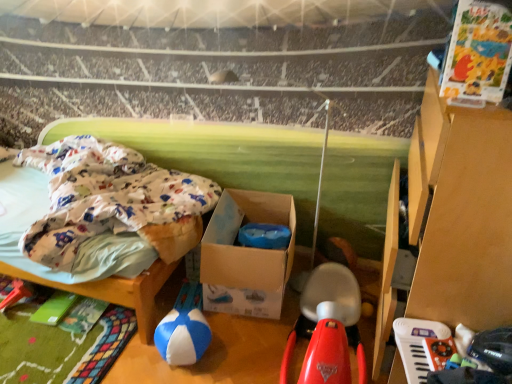
Question: Looking at their shapes, would you say cardboard box at center is wider or thinner than blue/white fabric ball at center, the 1th toy viewed from the left?

Choices:
 (A) wide
 (B) thin

Answer: (A)

Question: Considering the relative positions of cardboard box at center and blue/white fabric ball at center, the 1th toy viewed from the left, in the image provided, is cardboard box at center to the left or to the right of blue/white fabric ball at center, the 1th toy viewed from the left,?

Choices:
 (A) right
 (B) left

Answer: (A)

Question: Estimate the real-world distances between objects in this image. Which object is farther from the cardboard box at center?

Choices:
 (A) white fabric bed at upper left, acting as the 1th furniture starting from the left
 (B) blue/white fabric ball at center, the 1th toy viewed from the left
 (C) brown cardboard drawer at right, which appears as the second furniture when viewed from the left
 (D) rubberized red scooter at center, marked as the 2th toy in a right-to-left arrangement
 (E) white plastic keyboard at lower right, acting as the 3th toy starting from the left

Answer: (E)

Question: Based on their relative distances, which object is nearer to the rubberized red scooter at center, marked as the 2th toy in a right-to-left arrangement?

Choices:
 (A) white plastic keyboard at lower right, acting as the 3th toy starting from the left
 (B) white fabric bed at upper left, acting as the 1th furniture starting from the left
 (C) blue/white fabric ball at center, positioned as the 3th toy in right-to-left order
 (D) cardboard box at center
 (E) brown cardboard drawer at right, which appears as the second furniture when viewed from the left

Answer: (D)